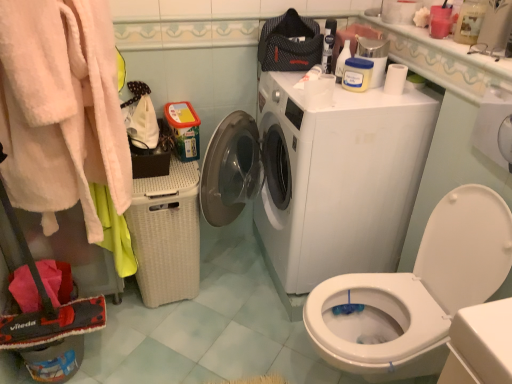
Locate an element on the screen. The width and height of the screenshot is (512, 384). vacant region to the right of white wicker laundry basket at left is located at coordinates (242, 288).